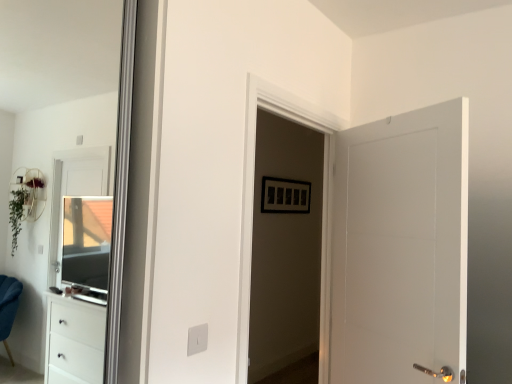
Question: Can you confirm if white matte door at right is bigger than white glossy door at center?

Choices:
 (A) yes
 (B) no

Answer: (A)

Question: Is white matte door at right looking in the opposite direction of white glossy door at center?

Choices:
 (A) no
 (B) yes

Answer: (B)

Question: Does white matte door at right have a smaller size compared to white glossy door at center?

Choices:
 (A) no
 (B) yes

Answer: (A)

Question: Is white matte door at right at the left side of white glossy door at center?

Choices:
 (A) no
 (B) yes

Answer: (A)

Question: Considering the relative sizes of white matte door at right and white glossy door at center in the image provided, is white matte door at right thinner than white glossy door at center?

Choices:
 (A) yes
 (B) no

Answer: (B)

Question: Relative to clear glass window at left, is white glossy door at center in front or behind?

Choices:
 (A) front
 (B) behind

Answer: (A)

Question: From a real-world perspective, is white glossy door at center above or below clear glass window at left?

Choices:
 (A) above
 (B) below

Answer: (A)

Question: Considering the positions of white glossy door at center and clear glass window at left in the image, is white glossy door at center taller or shorter than clear glass window at left?

Choices:
 (A) short
 (B) tall

Answer: (A)

Question: Is white glossy door at center wider or thinner than clear glass window at left?

Choices:
 (A) thin
 (B) wide

Answer: (B)

Question: Is white matte door at right bigger or smaller than clear glass window at left?

Choices:
 (A) big
 (B) small

Answer: (A)

Question: From a real-world perspective, is white matte door at right positioned above or below clear glass window at left?

Choices:
 (A) below
 (B) above

Answer: (B)

Question: Is white matte door at right inside the boundaries of clear glass window at left, or outside?

Choices:
 (A) inside
 (B) outside

Answer: (B)

Question: Is point (348, 319) closer or farther from the camera than point (95, 153)?

Choices:
 (A) closer
 (B) farther

Answer: (A)

Question: Is clear glass window at left in front of or behind white glossy door at center in the image?

Choices:
 (A) behind
 (B) front

Answer: (A)

Question: Considering the positions of clear glass window at left and white glossy door at center in the image, is clear glass window at left taller or shorter than white glossy door at center?

Choices:
 (A) short
 (B) tall

Answer: (B)